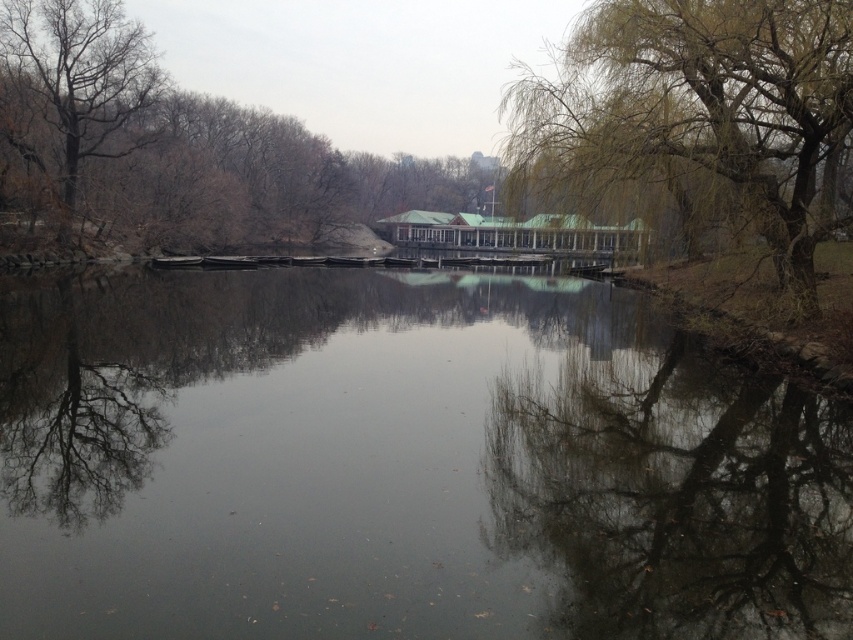
Question: Which point is farther to the camera?

Choices:
 (A) bare wood tree at upper left
 (B) bare branches at upper left
 (C) smooth reflective water at center

Answer: (A)

Question: Where is smooth reflective water at center located in relation to bare branches at upper left in the image?

Choices:
 (A) above
 (B) below

Answer: (B)

Question: Which point is closer to the camera?

Choices:
 (A) bare wood tree at upper left
 (B) bare branches at upper left

Answer: (B)

Question: Is bare branches at upper left above bare wood tree at upper left?

Choices:
 (A) no
 (B) yes

Answer: (B)

Question: Can you confirm if bare branches at upper left is positioned below green textured tree at right?

Choices:
 (A) yes
 (B) no

Answer: (A)

Question: Which of the following is the closest to the observer?

Choices:
 (A) smooth reflective water at center
 (B) green textured tree at right

Answer: (A)